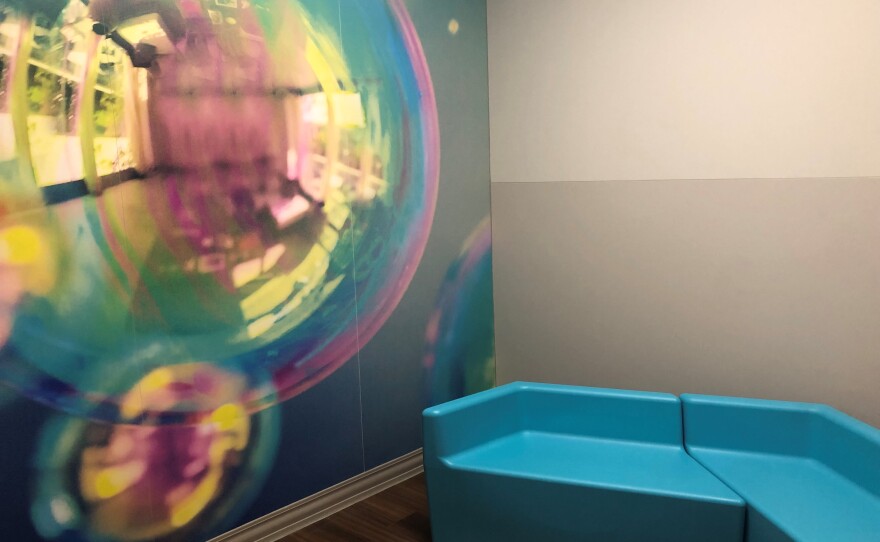
You are a GUI agent. You are given a task and a screenshot of the screen. Output one action in this format:
    pyautogui.click(x=<x>, y=<y>)
    Task: Click on the room
    The height and width of the screenshot is (542, 880).
    Given the screenshot: What is the action you would take?
    pyautogui.click(x=383, y=509)